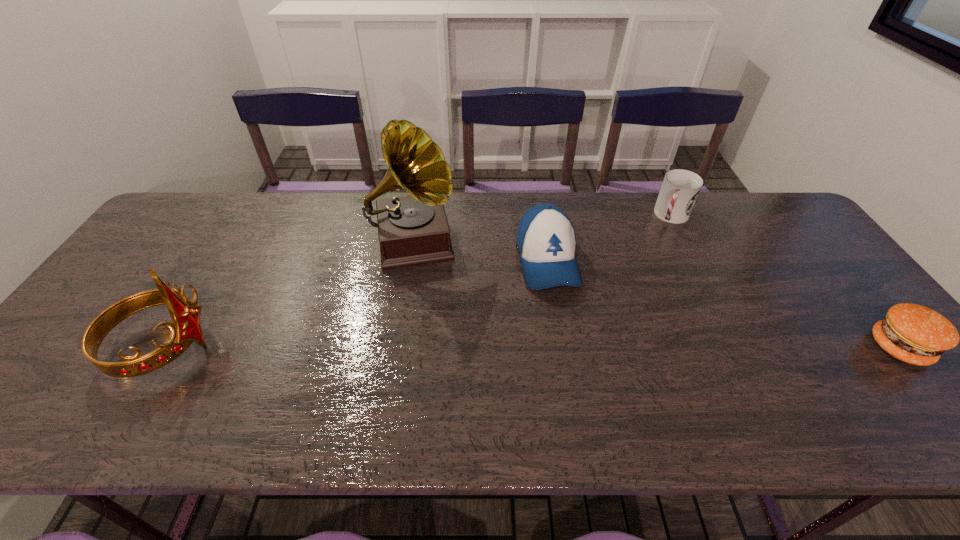
The height and width of the screenshot is (540, 960). I want to click on the leftmost object, so click(186, 328).

Where is `the fourth shortest object`? the fourth shortest object is located at coordinates tap(186, 328).

You are a GUI agent. You are given a task and a screenshot of the screen. Output one action in this format:
    pyautogui.click(x=<x>, y=<y>)
    Task: Click on the patty
    The height and width of the screenshot is (540, 960).
    Given the screenshot: What is the action you would take?
    pyautogui.click(x=912, y=333)

In order to click on the shortest object in this screenshot , I will do `click(912, 333)`.

You are a GUI agent. You are given a task and a screenshot of the screen. Output one action in this format:
    pyautogui.click(x=<x>, y=<y>)
    Task: Click on the third object from right to left
    The image size is (960, 540).
    Given the screenshot: What is the action you would take?
    pyautogui.click(x=546, y=240)

Locate an element on the screen. The image size is (960, 540). the fourth object from left to right is located at coordinates (680, 188).

Identify the location of the tallest object. The width and height of the screenshot is (960, 540). (x=414, y=229).

At what (x,y) coordinates should I click in order to perform the action: click on the second object from left to right. Please return your answer as a coordinate pair (x, y). This screenshot has width=960, height=540. Looking at the image, I should click on (414, 229).

This screenshot has width=960, height=540. Find the location of `vacant area situated 0.100m on the front-facing side of the tiara`. vacant area situated 0.100m on the front-facing side of the tiara is located at coordinates (256, 348).

I want to click on free space located on the left of the shortest object, so click(738, 347).